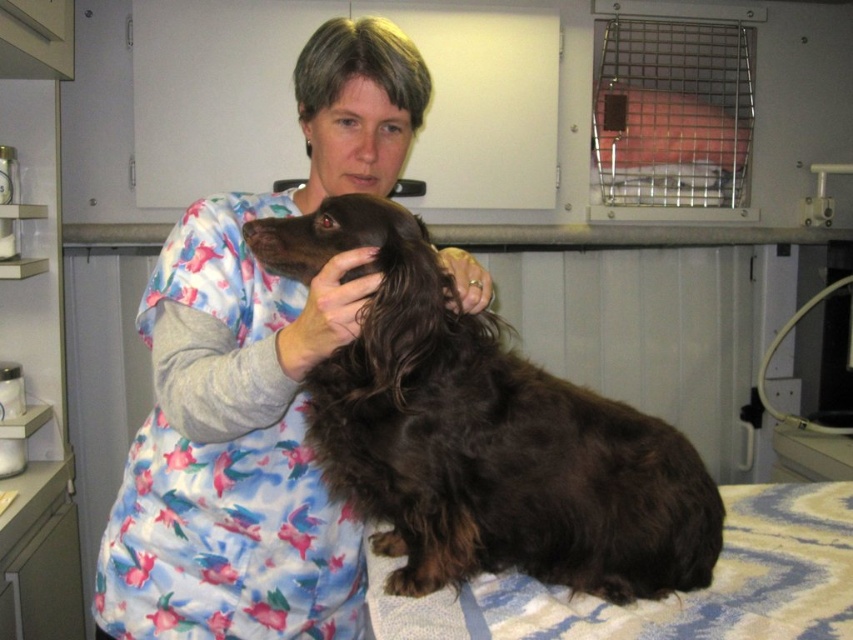
Is point (244, 557) farther from camera compared to point (483, 368)?

Yes, point (244, 557) is farther from viewer.

Which is in front, point (347, 122) or point (444, 412)?

Point (444, 412) is more forward.

At what (x,y) coordinates should I click in order to perform the action: click on fluffy brown dog at center. Please return your answer as a coordinate pair (x, y). The height and width of the screenshot is (640, 853). Looking at the image, I should click on (254, 385).